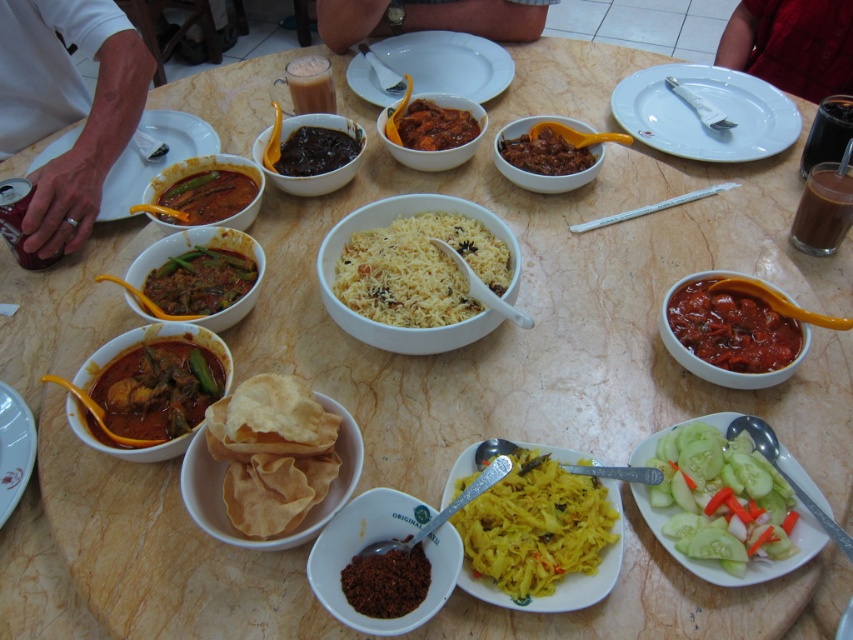
Question: Is dark glossy sauce at center bigger than brown matte stew at center?

Choices:
 (A) yes
 (B) no

Answer: (A)

Question: Which of the following is the closest to the observer?

Choices:
 (A) (579, 164)
 (B) (244, 284)
 (C) (367, 305)

Answer: (C)

Question: Which of the following is the closest to the observer?

Choices:
 (A) (697, 317)
 (B) (445, 88)
 (C) (155, 275)
 (D) (730, 141)

Answer: (A)

Question: Can you confirm if smooth skin hand at left is positioned above matte brown curry at center left?

Choices:
 (A) yes
 (B) no

Answer: (A)

Question: Does white rice at center have a smaller size compared to matte green curry at center left?

Choices:
 (A) yes
 (B) no

Answer: (B)

Question: Among these objects, which one is nearest to the camera?

Choices:
 (A) matte green curry at center left
 (B) matte brown spice at center
 (C) dark brown paste at center
 (D) matte red curry at center

Answer: (B)